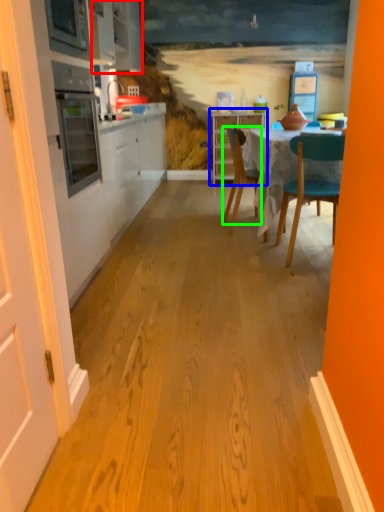
Question: Which object is positioned closest to cabinetry (highlighted by a red box)? Select from cabinetry (highlighted by a blue box) and chair (highlighted by a green box).

Choices:
 (A) cabinetry
 (B) chair

Answer: (B)